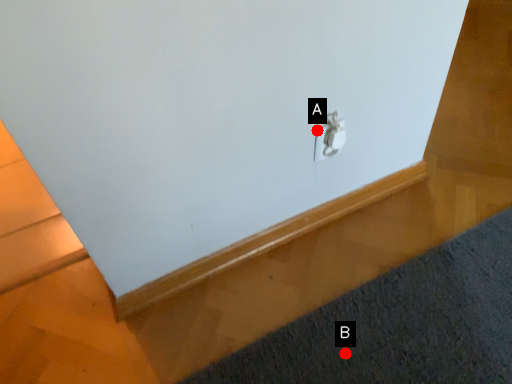
Question: Two points are circled on the image, labeled by A and B beside each circle. Among these points, which one is nearest to the camera?

Choices:
 (A) A is closer
 (B) B is closer

Answer: (B)